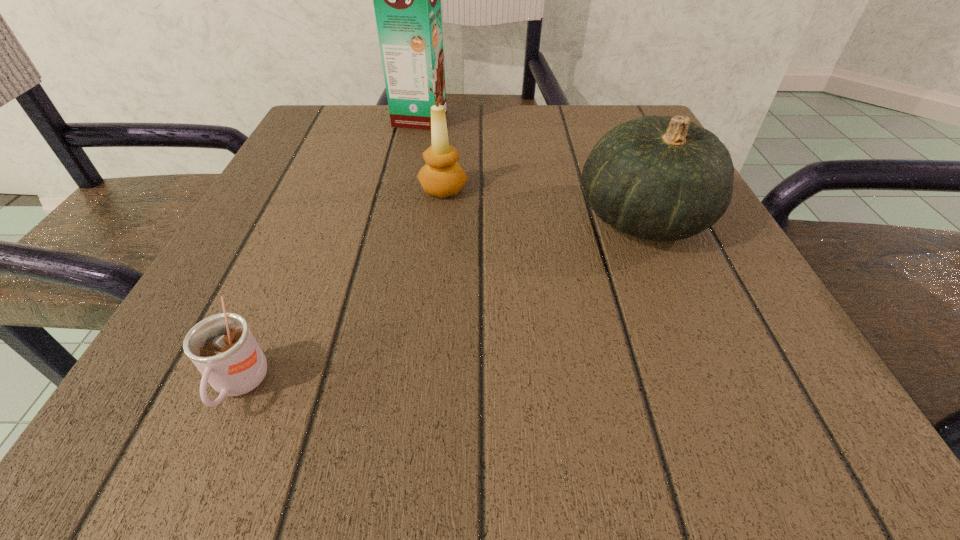
Identify the location of free point at the far right corner. The width and height of the screenshot is (960, 540). (602, 115).

You are a GUI agent. You are given a task and a screenshot of the screen. Output one action in this format:
    pyautogui.click(x=<x>, y=<y>)
    Task: Click on the vacant space at the near right corner of the desktop
    
    Given the screenshot: What is the action you would take?
    pyautogui.click(x=726, y=388)

This screenshot has width=960, height=540. Identify the location of free area in between the tallest object and the rightmost object. (532, 168).

At what (x,y) coordinates should I click in order to perform the action: click on empty space that is in between the carton and the shortest object. Please return your answer as a coordinate pair (x, y). This screenshot has height=540, width=960. Looking at the image, I should click on (330, 252).

At what (x,y) coordinates should I click in order to perform the action: click on blank region between the tallest object and the nearest object. Please return your answer as a coordinate pair (x, y). This screenshot has width=960, height=540. Looking at the image, I should click on (330, 252).

In order to click on free space between the rightmost object and the cup in this screenshot , I will do `click(442, 301)`.

Locate an element on the screen. The image size is (960, 540). vacant point located between the gourd and the candle_holder is located at coordinates (543, 204).

Identify the location of empty location between the farthest object and the cup. (330, 252).

Identify which object is located as the nearest to the nearest object. Please provide its 2D coordinates. Your answer should be formatted as a tuple, i.e. [(x, y)], where the tuple contains the x and y coordinates of a point satisfying the conditions above.

[(442, 176)]

Point out which object is positioned as the third nearest to the farthest object. Please provide its 2D coordinates. Your answer should be formatted as a tuple, i.e. [(x, y)], where the tuple contains the x and y coordinates of a point satisfying the conditions above.

[(222, 347)]